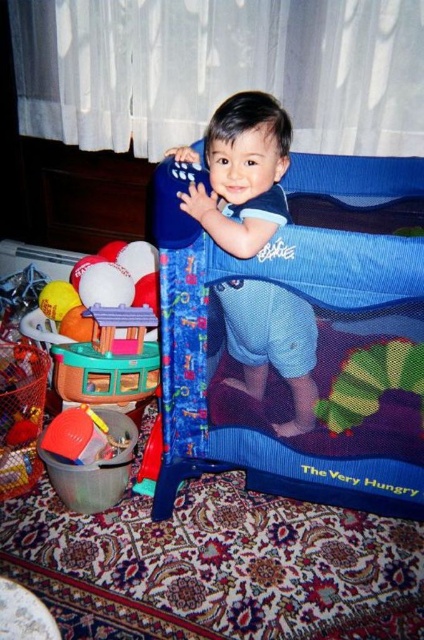
Question: Which object appears farthest from the camera in this image?

Choices:
 (A) blue fabric playpen at center
 (B) blue mesh playpen at center

Answer: (B)

Question: Is blue fabric playpen at center to the right of blue mesh playpen at center from the viewer's perspective?

Choices:
 (A) yes
 (B) no

Answer: (A)

Question: Is blue fabric playpen at center above blue mesh playpen at center?

Choices:
 (A) no
 (B) yes

Answer: (A)

Question: Is the position of blue fabric playpen at center less distant than that of blue mesh playpen at center?

Choices:
 (A) yes
 (B) no

Answer: (A)

Question: Which object appears farthest from the camera in this image?

Choices:
 (A) blue mesh playpen at center
 (B) blue fabric playpen at center

Answer: (A)